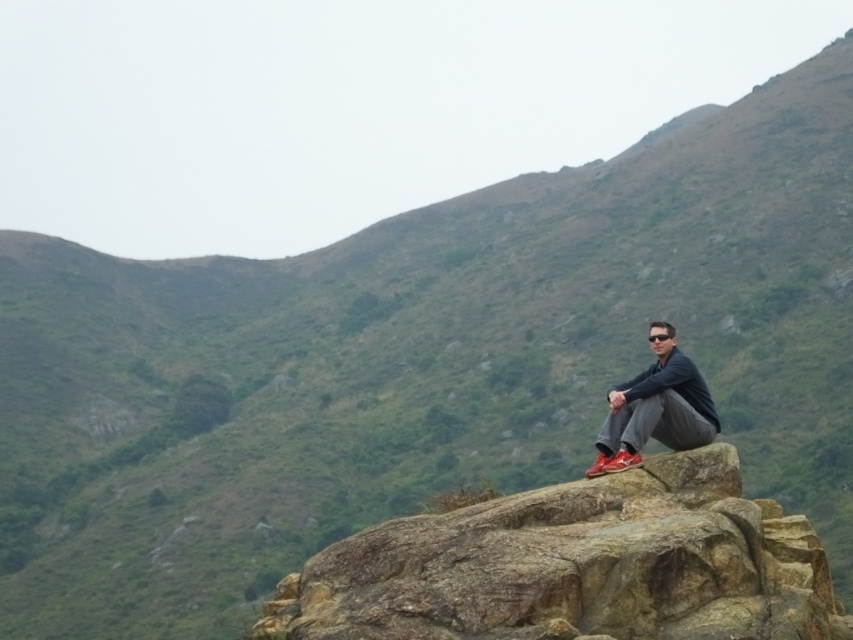
Can you confirm if brown rough rock at center is taller than matte black jacket at center?

Correct, brown rough rock at center is much taller as matte black jacket at center.

What do you see at coordinates (576, 566) in the screenshot? I see `brown rough rock at center` at bounding box center [576, 566].

The width and height of the screenshot is (853, 640). In order to click on brown rough rock at center in this screenshot , I will do `click(576, 566)`.